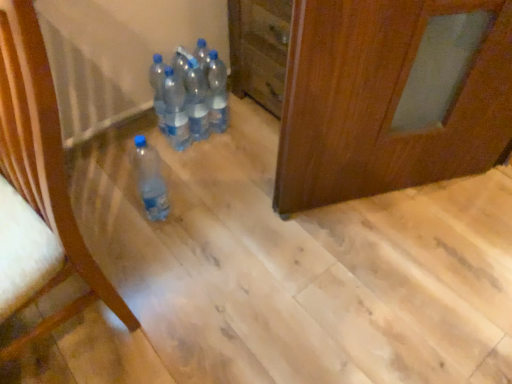
Image resolution: width=512 pixels, height=384 pixels. I want to click on free space in front of transparent plastic bottles at center, placed as the 5th bottle when sorted from left to right, so click(218, 156).